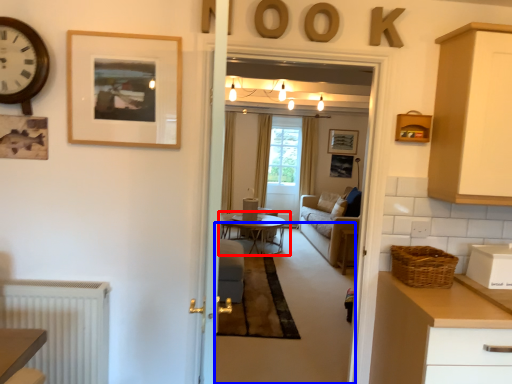
Question: Which point is further to the camera, coffee table (highlighted by a red box) or plain (highlighted by a blue box)?

Choices:
 (A) coffee table
 (B) plain

Answer: (A)